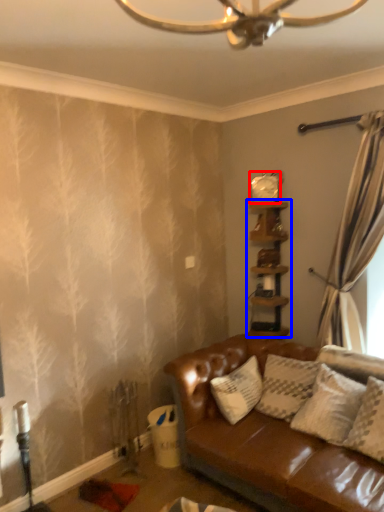
Question: Which object appears farthest to the camera in this image, clock (highlighted by a red box) or shelf (highlighted by a blue box)?

Choices:
 (A) clock
 (B) shelf

Answer: (A)